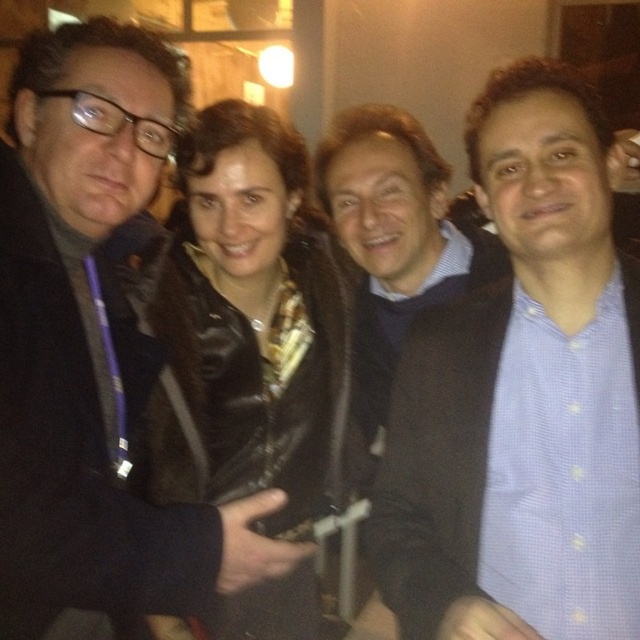
Between blue checkered shirt at center and matte black coat at left, which one appears on the left side from the viewer's perspective?

From the viewer's perspective, matte black coat at left appears more on the left side.

Is point (612, 276) more distant than point (113, 500)?

No, (612, 276) is in front of (113, 500).

The image size is (640, 640). Describe the element at coordinates (522, 397) in the screenshot. I see `blue checkered shirt at center` at that location.

Where is `blue checkered shirt at center`? The width and height of the screenshot is (640, 640). blue checkered shirt at center is located at coordinates (522, 397).

Between matte black coat at left and black leather jacket at center, which one is positioned higher?

matte black coat at left is higher up.

Between point (150, 113) and point (225, 182), which one is positioned in front?

Point (150, 113) is more forward.

Image resolution: width=640 pixels, height=640 pixels. What are the coordinates of `matte black coat at left` in the screenshot? It's located at (92, 353).

Is point (513, 404) farther from viewer compared to point (147, 440)?

No.

Between point (508, 552) and point (228, 401), which one is positioned behind?

Point (228, 401)

What do you see at coordinates (522, 397) in the screenshot?
I see `blue checkered shirt at center` at bounding box center [522, 397].

This screenshot has height=640, width=640. Identify the location of blue checkered shirt at center. pyautogui.click(x=522, y=397).